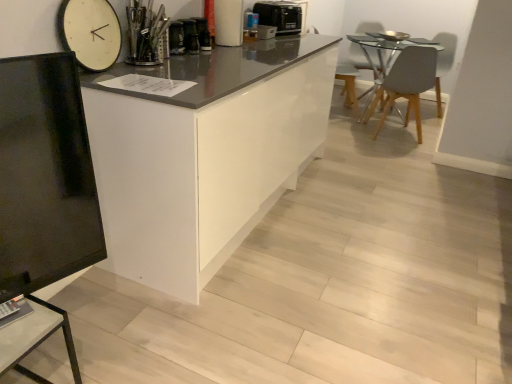
Question: Can you confirm if matte gray swivel chair at upper right, the first swivel chair viewed from the right, is taller than white wooden clock at upper left?

Choices:
 (A) no
 (B) yes

Answer: (B)

Question: Does matte gray swivel chair at upper right, the 2th swivel chair positioned from the left, appear on the right side of white wooden clock at upper left?

Choices:
 (A) no
 (B) yes

Answer: (B)

Question: Considering the relative sizes of matte gray swivel chair at upper right, the 2th swivel chair positioned from the left, and white wooden clock at upper left in the image provided, is matte gray swivel chair at upper right, the 2th swivel chair positioned from the left, thinner than white wooden clock at upper left?

Choices:
 (A) yes
 (B) no

Answer: (B)

Question: Is white wooden clock at upper left at the back of matte gray swivel chair at upper right, the first swivel chair viewed from the right?

Choices:
 (A) yes
 (B) no

Answer: (B)

Question: Is matte gray swivel chair at upper right, the first swivel chair viewed from the right, wider than white wooden clock at upper left?

Choices:
 (A) no
 (B) yes

Answer: (B)

Question: In terms of height, does white wooden clock at upper left look taller or shorter compared to matte black tv stand at lower left?

Choices:
 (A) short
 (B) tall

Answer: (A)

Question: Based on their positions, is white wooden clock at upper left located to the left or right of matte black tv stand at lower left?

Choices:
 (A) left
 (B) right

Answer: (B)

Question: Considering their positions, is white wooden clock at upper left located in front of or behind matte black tv stand at lower left?

Choices:
 (A) behind
 (B) front

Answer: (A)

Question: Considering the positions of white wooden clock at upper left and matte black tv stand at lower left in the image, is white wooden clock at upper left wider or thinner than matte black tv stand at lower left?

Choices:
 (A) wide
 (B) thin

Answer: (B)

Question: Considering the positions of black plastic toaster at upper center and white glossy cabinet at center in the image, is black plastic toaster at upper center bigger or smaller than white glossy cabinet at center?

Choices:
 (A) small
 (B) big

Answer: (A)

Question: Considering the positions of point (278, 9) and point (221, 147), is point (278, 9) closer or farther from the camera than point (221, 147)?

Choices:
 (A) closer
 (B) farther

Answer: (B)

Question: Which is correct: black plastic toaster at upper center is inside white glossy cabinet at center, or outside of it?

Choices:
 (A) inside
 (B) outside

Answer: (B)

Question: Considering their positions, is black plastic toaster at upper center located in front of or behind white glossy cabinet at center?

Choices:
 (A) behind
 (B) front

Answer: (A)

Question: From a real-world perspective, relative to gray matte chair at right, is matte gray swivel chair at upper right, the 2th swivel chair positioned from the left, vertically above or below?

Choices:
 (A) above
 (B) below

Answer: (A)

Question: From the image's perspective, relative to gray matte chair at right, is matte gray swivel chair at upper right, the first swivel chair viewed from the right, above or below?

Choices:
 (A) above
 (B) below

Answer: (A)